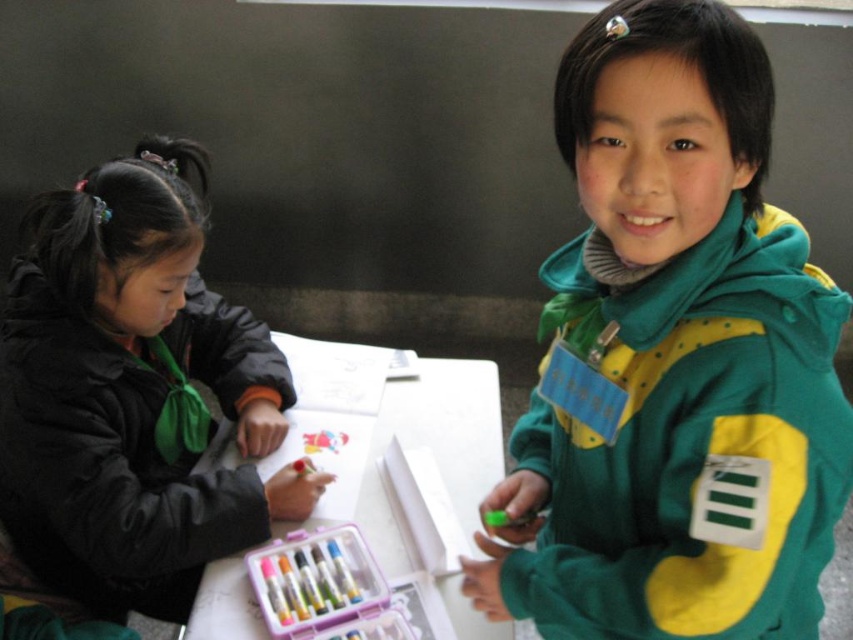
Question: Which object appears farthest from the camera in this image?

Choices:
 (A) white paper at center
 (B) green fleece jacket at upper right
 (C) black matte jacket at left

Answer: (C)

Question: Can you confirm if green fleece jacket at upper right is bigger than white paper at center?

Choices:
 (A) no
 (B) yes

Answer: (B)

Question: Which object is farther from the camera taking this photo?

Choices:
 (A) white paper at center
 (B) green fleece jacket at upper right
 (C) black matte jacket at left

Answer: (C)

Question: Is black matte jacket at left above white paper at center?

Choices:
 (A) yes
 (B) no

Answer: (A)

Question: Is black matte jacket at left behind white paper at center?

Choices:
 (A) no
 (B) yes

Answer: (B)

Question: Which object is positioned farthest from the green fleece jacket at upper right?

Choices:
 (A) black matte jacket at left
 (B) white paper at center

Answer: (A)